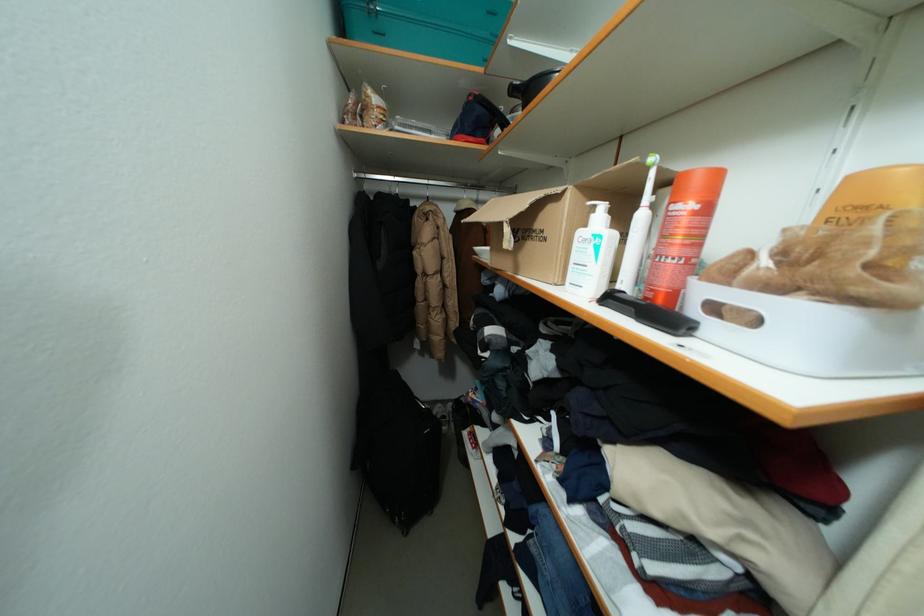
You are a GUI agent. You are given a task and a screenshot of the screen. Output one action in this format:
    pyautogui.click(x=<x>, y=<y>)
    Task: Click on the white bottle pump
    The height and width of the screenshot is (616, 924).
    Given the screenshot: What is the action you would take?
    pyautogui.click(x=591, y=254)